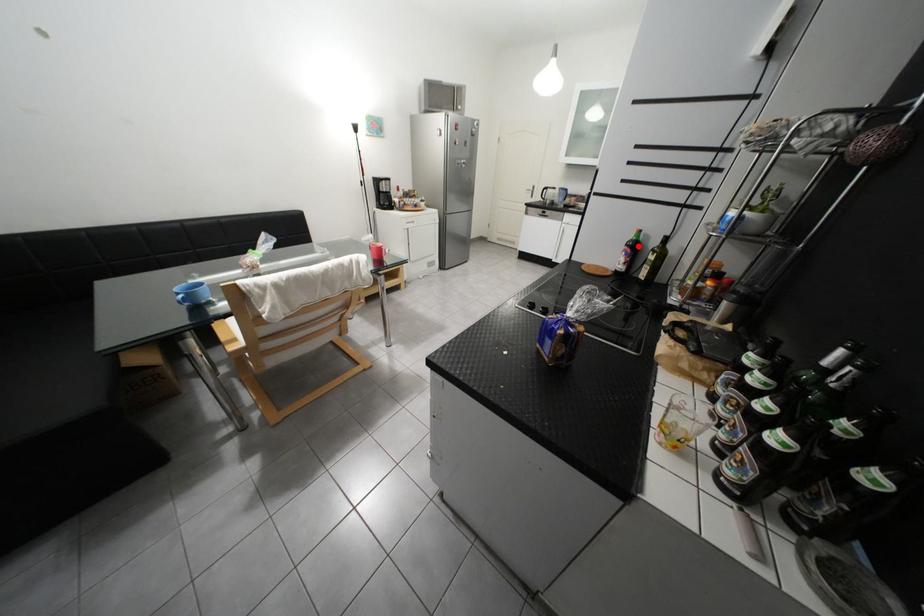
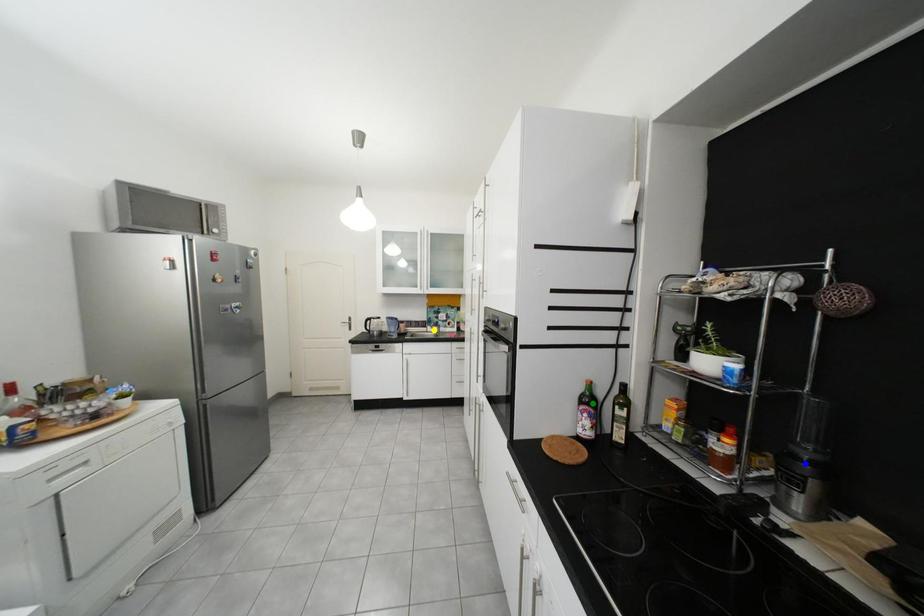
Question: I am providing you with two images of the same scene from different viewpoints. A red point is marked on the first image. You are given multiple points on the second image. Which point in image 2 is actually the same real-world point as the red point in image 1?

Choices:
 (A) green point
 (B) yellow point
 (C) blue point

Answer: (A)